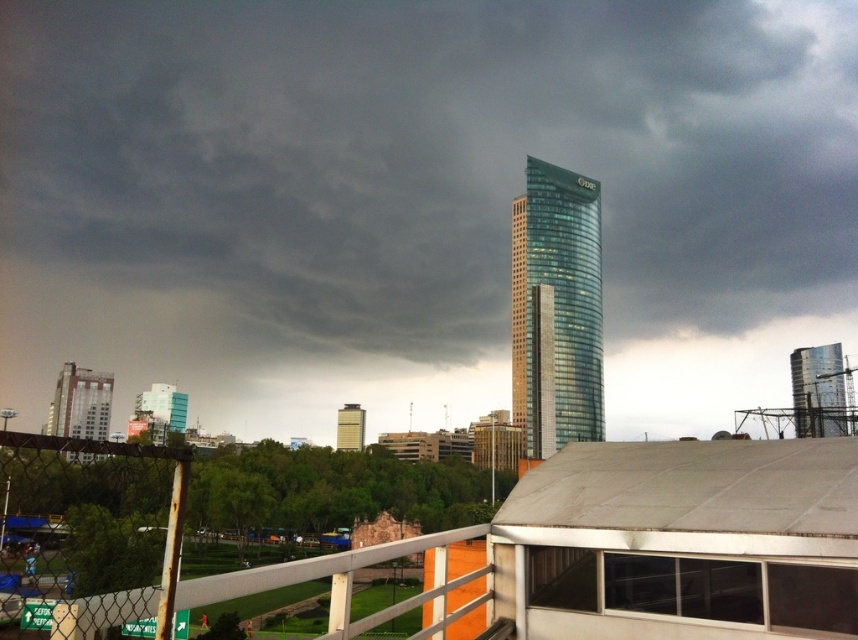
Question: Which of the following is the closest to the observer?

Choices:
 (A) (597, 356)
 (B) (88, 416)

Answer: (A)

Question: Does matte silver building at left have a larger size compared to matte gray building at center?

Choices:
 (A) no
 (B) yes

Answer: (B)

Question: Does dark gray glass skyscraper at center appear on the right side of matte gray building at center?

Choices:
 (A) yes
 (B) no

Answer: (A)

Question: Which point appears closest to the camera in this image?

Choices:
 (A) (458, 116)
 (B) (85, 392)
 (C) (795, 387)
 (D) (349, 451)

Answer: (D)

Question: Considering the relative positions of dark gray glass skyscraper at center and matte gray building at center in the image provided, where is dark gray glass skyscraper at center located with respect to matte gray building at center?

Choices:
 (A) above
 (B) below

Answer: (A)

Question: Which of the following is the closest to the observer?

Choices:
 (A) glassy reflective tower at upper right
 (B) glassy teal skyscraper at center
 (C) blue glass building at lower left
 (D) matte silver building at left

Answer: (D)